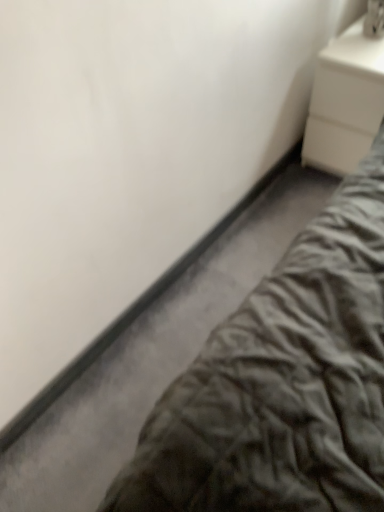
The width and height of the screenshot is (384, 512). I want to click on white matte nightstand at upper right, so click(x=345, y=101).

What is the approximate height of white matte nightstand at upper right?

white matte nightstand at upper right is 22.18 inches in height.

Describe the element at coordinates (345, 101) in the screenshot. The width and height of the screenshot is (384, 512). I see `white matte nightstand at upper right` at that location.

Measure the distance between white matte nightstand at upper right and camera.

white matte nightstand at upper right is 1.59 meters from camera.

Where is `velvet gray bed at lower right`? velvet gray bed at lower right is located at coordinates (282, 382).

This screenshot has width=384, height=512. Describe the element at coordinates (282, 382) in the screenshot. I see `velvet gray bed at lower right` at that location.

Identify the location of white matte nightstand at upper right. (345, 101).

Which object is positioned more to the left, velvet gray bed at lower right or white matte nightstand at upper right?

From the viewer's perspective, velvet gray bed at lower right appears more on the left side.

Is the depth of velvet gray bed at lower right less than that of white matte nightstand at upper right?

Yes, the depth of velvet gray bed at lower right is less than that of white matte nightstand at upper right.

Does point (263, 338) appear closer or farther from the camera than point (317, 115)?

Point (263, 338) is positioned closer to the camera compared to point (317, 115).

From the image's perspective, who appears lower, velvet gray bed at lower right or white matte nightstand at upper right?

velvet gray bed at lower right.

From a real-world perspective, which is physically above, velvet gray bed at lower right or white matte nightstand at upper right?

white matte nightstand at upper right, from a real-world perspective.

Considering the sizes of objects velvet gray bed at lower right and white matte nightstand at upper right in the image provided, who is thinner, velvet gray bed at lower right or white matte nightstand at upper right?

white matte nightstand at upper right.

Looking at this image, considering the sizes of objects velvet gray bed at lower right and white matte nightstand at upper right in the image provided, who is taller, velvet gray bed at lower right or white matte nightstand at upper right?

Standing taller between the two is white matte nightstand at upper right.

From the picture: Considering the sizes of objects velvet gray bed at lower right and white matte nightstand at upper right in the image provided, who is bigger, velvet gray bed at lower right or white matte nightstand at upper right?

white matte nightstand at upper right.

Would you say velvet gray bed at lower right is inside or outside white matte nightstand at upper right?

velvet gray bed at lower right is not inside white matte nightstand at upper right, it's outside.

Is velvet gray bed at lower right next to white matte nightstand at upper right and touching it?

No, velvet gray bed at lower right is not beside white matte nightstand at upper right.

Is velvet gray bed at lower right facing towards white matte nightstand at upper right?

No, velvet gray bed at lower right is not turned towards white matte nightstand at upper right.

How different are the orientations of velvet gray bed at lower right and white matte nightstand at upper right in degrees?

The angular difference between velvet gray bed at lower right and white matte nightstand at upper right is 0.0482 degrees.

Find the location of a particular element. The image size is (384, 512). bed that appears below the white matte nightstand at upper right (from the image's perspective) is located at coordinates (282, 382).

Consider the image. Considering the relative positions of white matte nightstand at upper right and velvet gray bed at lower right in the image provided, is white matte nightstand at upper right to the left of velvet gray bed at lower right from the viewer's perspective?

Incorrect, white matte nightstand at upper right is not on the left side of velvet gray bed at lower right.

Between white matte nightstand at upper right and velvet gray bed at lower right, which one is positioned behind?

white matte nightstand at upper right is further away from the camera.

Is point (345, 165) positioned in front of point (382, 176)?

No, it is behind (382, 176).

From the image's perspective, would you say white matte nightstand at upper right is positioned over velvet gray bed at lower right?

Yes.

From a real-world perspective, between white matte nightstand at upper right and velvet gray bed at lower right, who is vertically higher?

In real-world perspective, white matte nightstand at upper right is above.

Looking at their sizes, would you say white matte nightstand at upper right is wider or thinner than velvet gray bed at lower right?

white matte nightstand at upper right is thinner than velvet gray bed at lower right.

Considering the relative sizes of white matte nightstand at upper right and velvet gray bed at lower right in the image provided, is white matte nightstand at upper right shorter than velvet gray bed at lower right?

In fact, white matte nightstand at upper right may be taller than velvet gray bed at lower right.

Considering the sizes of white matte nightstand at upper right and velvet gray bed at lower right in the image, is white matte nightstand at upper right bigger or smaller than velvet gray bed at lower right?

In the image, white matte nightstand at upper right appears to be larger than velvet gray bed at lower right.

Can we say white matte nightstand at upper right lies outside velvet gray bed at lower right?

Yes.

Are white matte nightstand at upper right and velvet gray bed at lower right making contact?

white matte nightstand at upper right is not next to velvet gray bed at lower right, and they're not touching.

Could you tell me if white matte nightstand at upper right is turned towards velvet gray bed at lower right?

Yes, white matte nightstand at upper right is aimed at velvet gray bed at lower right.

There is a velvet gray bed at lower right. Where is `nightstand above it (from a real-world perspective)`? nightstand above it (from a real-world perspective) is located at coordinates point(345,101).

Where is `bed below the white matte nightstand at upper right (from a real-world perspective)`? bed below the white matte nightstand at upper right (from a real-world perspective) is located at coordinates (282, 382).

Identify the location of nightstand on the right side of velvet gray bed at lower right. The width and height of the screenshot is (384, 512). (345, 101).